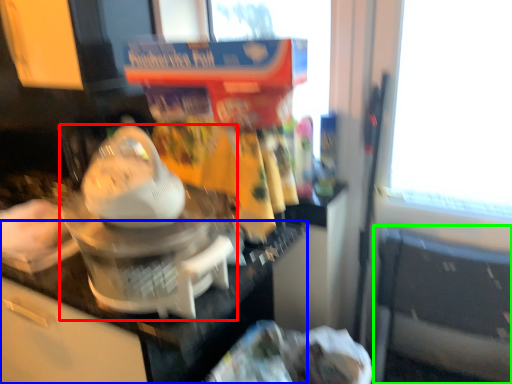
Question: Considering the real-world distances, which object is closest to kitchen appliance (highlighted by a red box)? counter top (highlighted by a blue box) or chair (highlighted by a green box).

Choices:
 (A) counter top
 (B) chair

Answer: (A)